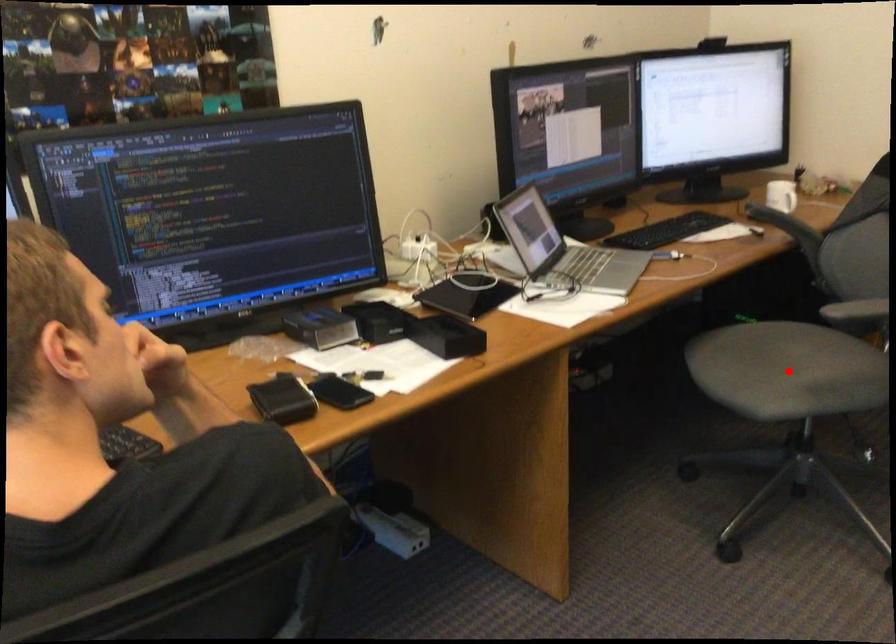
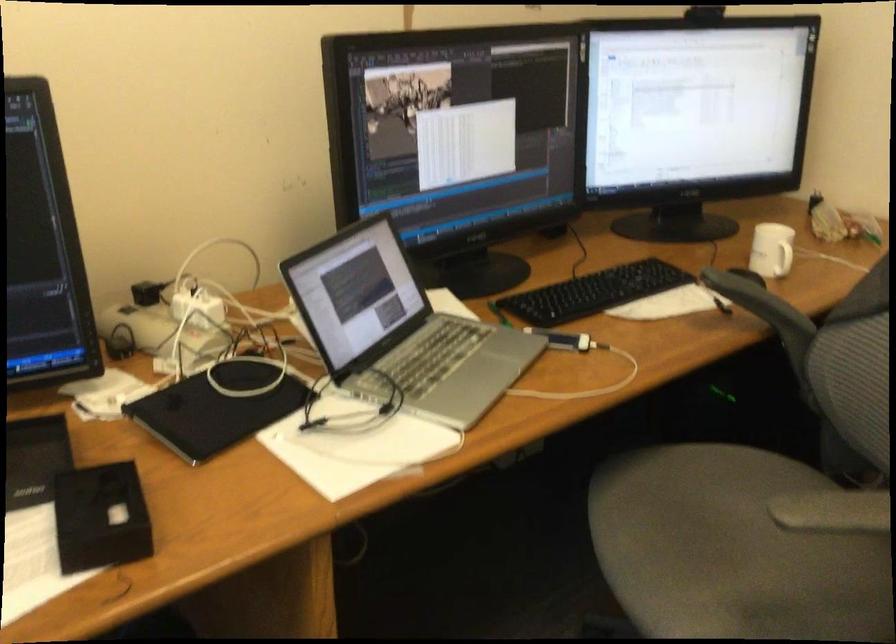
Find the pixel in the second image that matches the highlighted location in the first image.

(733, 550)